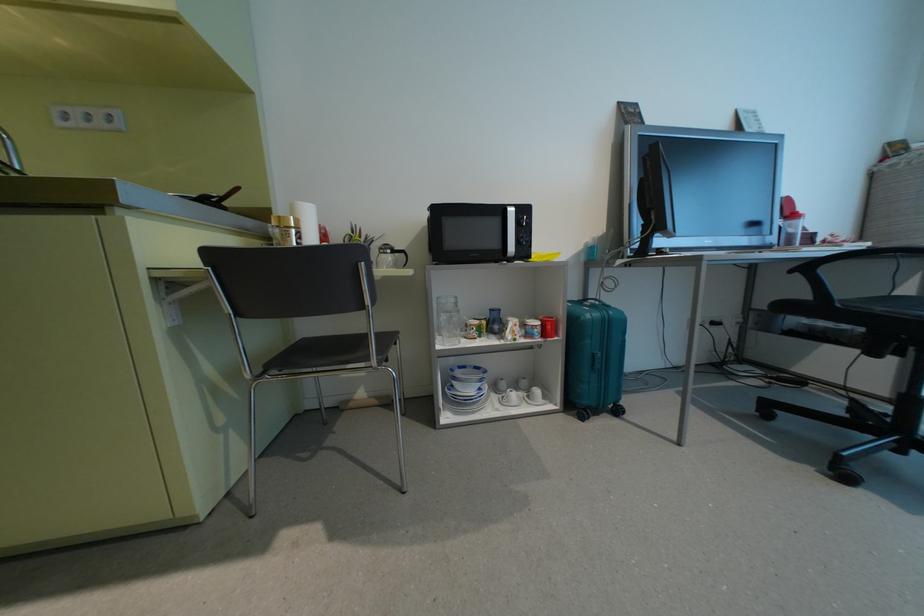
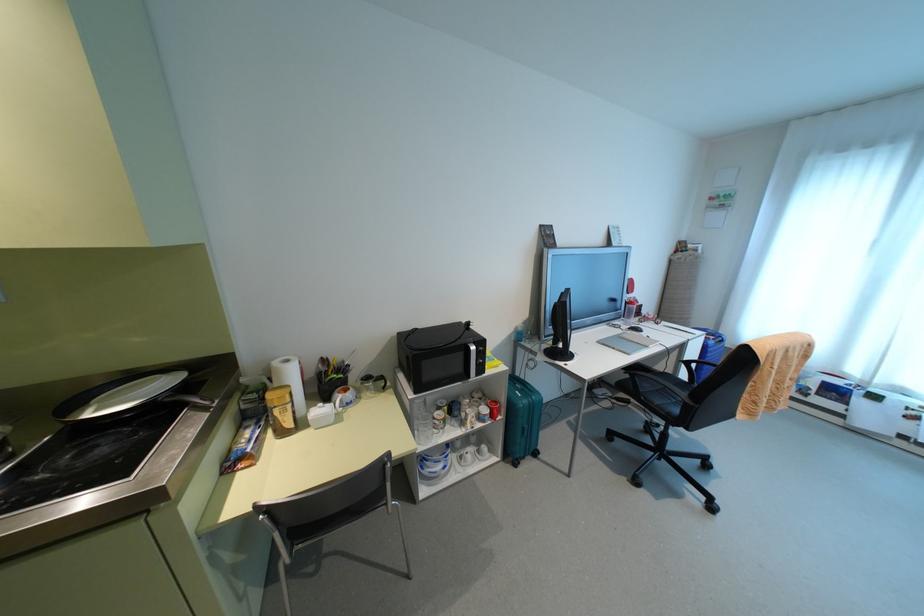
Find the pixel in the second image that matches (448,389) in the first image.

(420, 466)